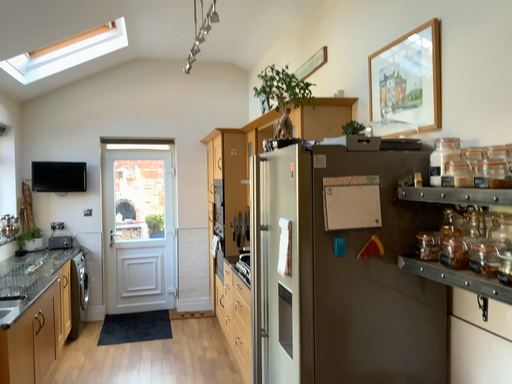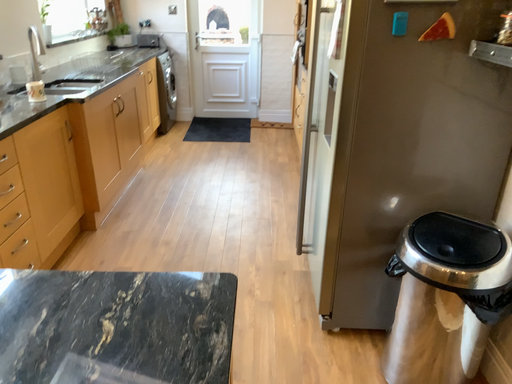
Question: Which way did the camera rotate in the video?

Choices:
 (A) rotated upward
 (B) rotated downward

Answer: (B)